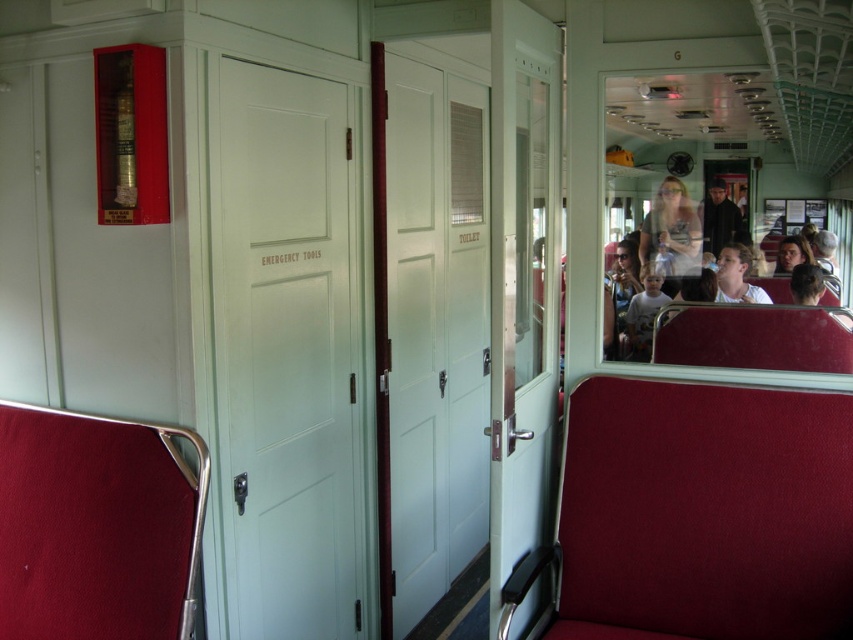
Question: Which point is closer to the camera?

Choices:
 (A) (805, 262)
 (B) (735, 285)
 (C) (688, 220)

Answer: (A)

Question: Can you confirm if matte black jacket at upper right is positioned below smooth brown hair at right?

Choices:
 (A) yes
 (B) no

Answer: (B)

Question: Is dark gray fabric coach at center in front of light brown hair at center?

Choices:
 (A) yes
 (B) no

Answer: (B)

Question: Which object is positioned closest to the smooth brown hair at right?

Choices:
 (A) light gray t-shirt at center
 (B) matte black jacket at upper right
 (C) dark gray fabric coach at center
 (D) light brown hair at center

Answer: (D)

Question: Is light brown hair at center below smooth brown hair at right?

Choices:
 (A) yes
 (B) no

Answer: (A)

Question: Which of the following is the farthest from the observer?

Choices:
 (A) (642, 321)
 (B) (718, 212)
 (C) (798, 260)

Answer: (A)